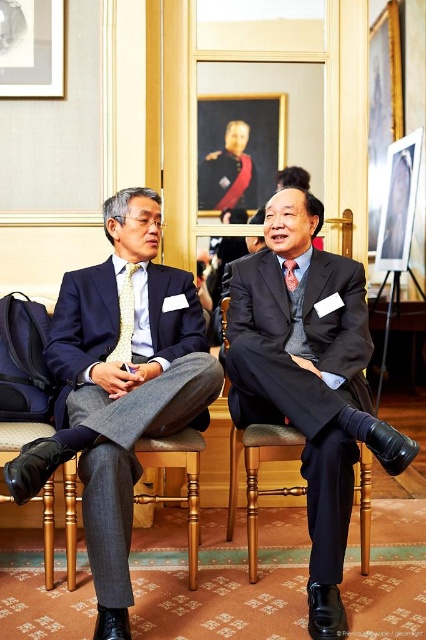
Based on the photo, can you confirm if oil painting at upper center is shorter than wooden chair at center?

In fact, oil painting at upper center may be taller than wooden chair at center.

Is oil painting at upper center thinner than wooden chair at center?

No.

You are a GUI agent. You are given a task and a screenshot of the screen. Output one action in this format:
    pyautogui.click(x=<x>, y=<y>)
    Task: Click on the oil painting at upper center
    The image size is (426, 640).
    Given the screenshot: What is the action you would take?
    pyautogui.click(x=238, y=148)

Where is `navy blue suit at left`? navy blue suit at left is located at coordinates (120, 388).

Is point (126, 579) behind point (233, 188)?

No.

The height and width of the screenshot is (640, 426). What are the coordinates of `navy blue suit at left` in the screenshot? It's located at (120, 388).

The height and width of the screenshot is (640, 426). Identify the location of navy blue suit at left. (120, 388).

In the scene shown: Does navy blue suit at left appear under matte black suit at center?

Actually, navy blue suit at left is above matte black suit at center.

Is navy blue suit at left taller than matte black suit at center?

Incorrect, navy blue suit at left's height is not larger of matte black suit at center's.

At what (x,y) coordinates should I click in order to perform the action: click on navy blue suit at left. Please return your answer as a coordinate pair (x, y). The image size is (426, 640). Looking at the image, I should click on (120, 388).

At what (x,y) coordinates should I click in order to perform the action: click on navy blue suit at left. Please return your answer as a coordinate pair (x, y). Looking at the image, I should click on 120,388.